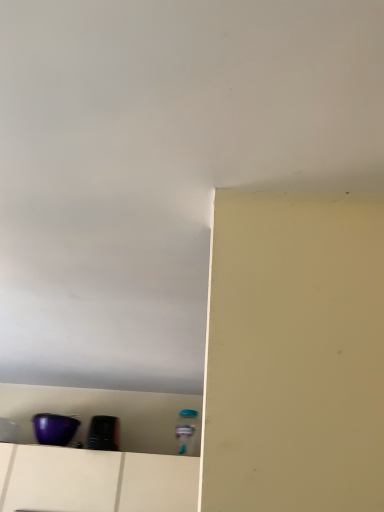
Question: From the image's perspective, is purple plastic container at lower left above purple glossy bowl at lower left, the 2th appliance from the right?

Choices:
 (A) no
 (B) yes

Answer: (A)

Question: Can you confirm if purple plastic container at lower left is positioned to the left of purple glossy bowl at lower left, the 1th appliance viewed from the left?

Choices:
 (A) no
 (B) yes

Answer: (A)

Question: Does purple plastic container at lower left turn towards purple glossy bowl at lower left, the 2th appliance from the right?

Choices:
 (A) no
 (B) yes

Answer: (A)

Question: From a real-world perspective, is purple plastic container at lower left positioned under purple glossy bowl at lower left, the 2th appliance from the right, based on gravity?

Choices:
 (A) yes
 (B) no

Answer: (A)

Question: Considering the relative sizes of purple plastic container at lower left and purple glossy bowl at lower left, the 2th appliance from the right, in the image provided, is purple plastic container at lower left wider than purple glossy bowl at lower left, the 2th appliance from the right,?

Choices:
 (A) yes
 (B) no

Answer: (A)

Question: Does purple plastic container at lower left lie in front of purple glossy bowl at lower left, the 1th appliance viewed from the left?

Choices:
 (A) yes
 (B) no

Answer: (A)

Question: Is black glossy toaster at lower left, the 2th appliance in the left-to-right sequence, positioned in front of purple plastic container at lower left?

Choices:
 (A) yes
 (B) no

Answer: (B)

Question: Is black glossy toaster at lower left, the 2th appliance in the left-to-right sequence, bigger than purple plastic container at lower left?

Choices:
 (A) yes
 (B) no

Answer: (B)

Question: From the image's perspective, is black glossy toaster at lower left, the 2th appliance in the left-to-right sequence, under purple plastic container at lower left?

Choices:
 (A) no
 (B) yes

Answer: (A)

Question: Is black glossy toaster at lower left, the 2th appliance in the left-to-right sequence, thinner than purple plastic container at lower left?

Choices:
 (A) yes
 (B) no

Answer: (A)

Question: Does black glossy toaster at lower left, positioned as the first appliance in right-to-left order, have a greater width compared to purple plastic container at lower left?

Choices:
 (A) no
 (B) yes

Answer: (A)

Question: Is the depth of black glossy toaster at lower left, the 2th appliance in the left-to-right sequence, greater than that of purple plastic container at lower left?

Choices:
 (A) yes
 (B) no

Answer: (A)

Question: Is purple glossy bowl at lower left, the 2th appliance from the right, looking in the opposite direction of purple plastic container at lower left?

Choices:
 (A) no
 (B) yes

Answer: (A)